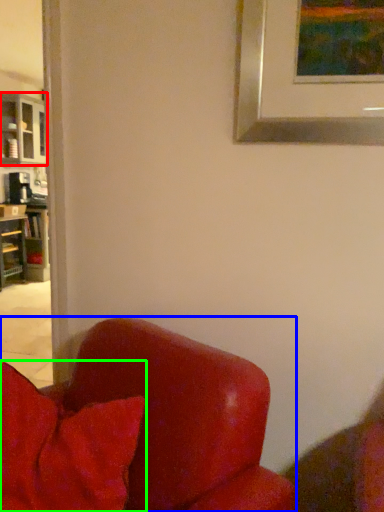
Question: Considering the real-world distances, which object is farthest from cabinetry (highlighted by a red box)? chair (highlighted by a blue box) or pillow (highlighted by a green box)?

Choices:
 (A) chair
 (B) pillow

Answer: (A)